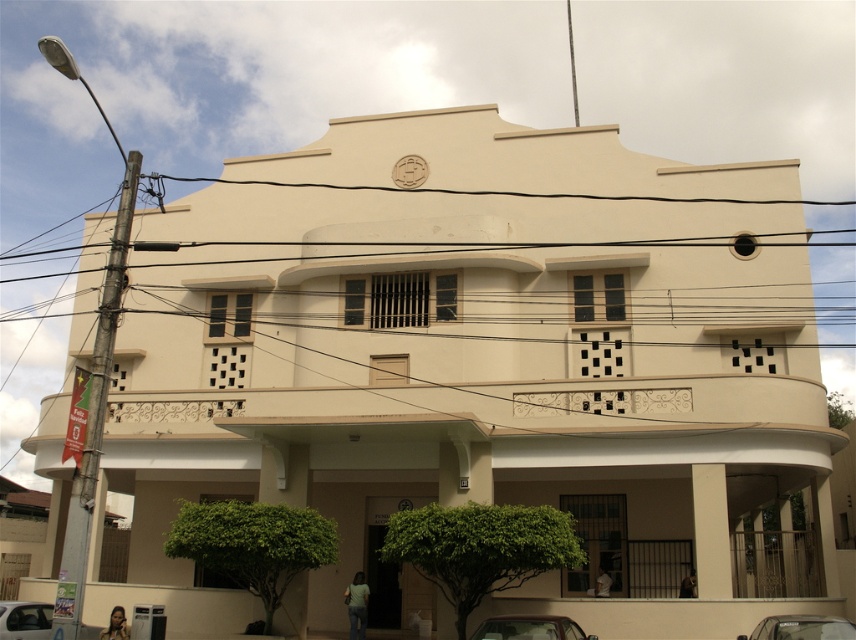
You are a delivery person trying to park your metallic silver car at lower center near the entrance of the two story building. The black wire at upper center is blocking the path. Can you drive around it?

The black wire at upper center is larger in size than metallic silver car at lower center, so it might block the path. However, since the black wire is located at the upper center of the building, it is positioned above the entrance. You can safely drive around it by parking near the entrance without obstruction.

You are standing in front of the two story building and want to reach the point at coordinates point (782, 627). Considering the building is 34.76 meters away from you, can you estimate how far you need to walk to reach that point?

The point (782, 627) is 34.76 meters away from the viewer, so you need to walk approximately 34.76 meters to reach it.